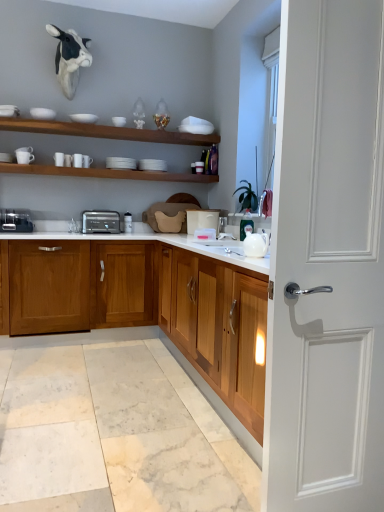
Question: From a real-world perspective, is white matte bowl at upper center, the fourth tableware from the bottom, positioned above or below white matte cow head at upper left?

Choices:
 (A) below
 (B) above

Answer: (A)

Question: Relative to white matte cow head at upper left, is white matte bowl at upper center, the fourth tableware from the bottom, in front or behind?

Choices:
 (A) front
 (B) behind

Answer: (B)

Question: Which of these objects is positioned closest to the white matte bowl at upper center, the 2th tableware viewed from the top?

Choices:
 (A) black plastic toaster at center
 (B) white glossy mug at left, arranged as the fifth tableware when viewed from the right
 (C) white glossy teapot at right
 (D) wooden shelf at upper center, which is the 2th shelf from top to bottom
 (E) wooden cabinets at center

Answer: (B)

Question: Estimate the real-world distances between objects in this image. Which object is farther from the wooden cabinets at center?

Choices:
 (A) white glossy shelves at upper center, the second shelf positioned from the bottom
 (B) white glossy bowl at upper center, the 5th tableware when ordered from left to right
 (C) white glossy mug at left, which ranks as the 1th tableware in bottom-to-top order
 (D) white matte cow head at upper left
 (E) white matte bowl at upper center, acting as the fourth tableware starting from the left

Answer: (D)